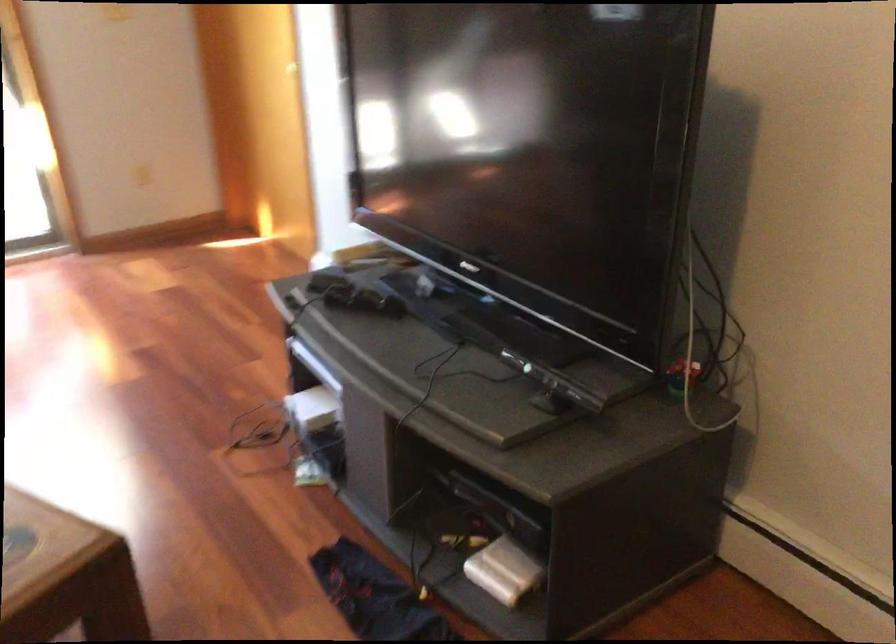
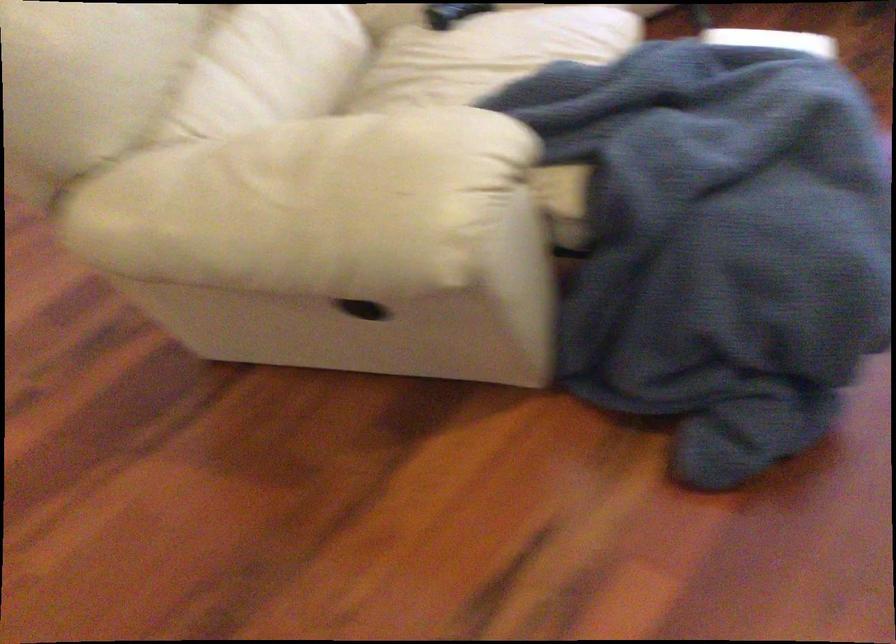
The images are taken continuously from a first-person perspective. In which direction is your viewpoint rotating?

The rotation direction of the camera is left-down.